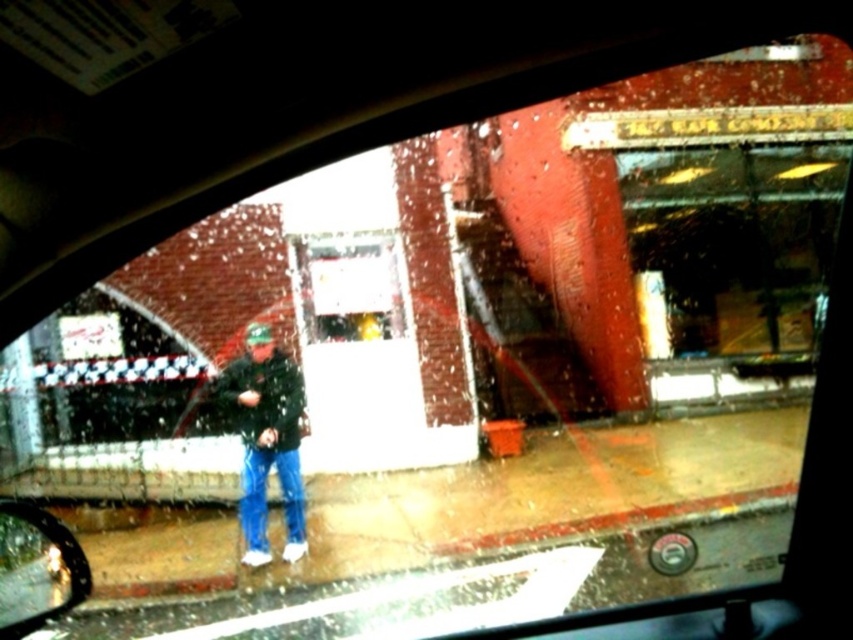
Between dark green textured jacket at center and shiny black mirror at lower left, which one appears on the left side from the viewer's perspective?

From the viewer's perspective, shiny black mirror at lower left appears more on the left side.

Which is above, dark green textured jacket at center or shiny black mirror at lower left?

shiny black mirror at lower left

Is point (252, 422) less distant than point (78, 561)?

No, (252, 422) is further to viewer.

Where is `dark green textured jacket at center`? The height and width of the screenshot is (640, 853). dark green textured jacket at center is located at coordinates (265, 438).